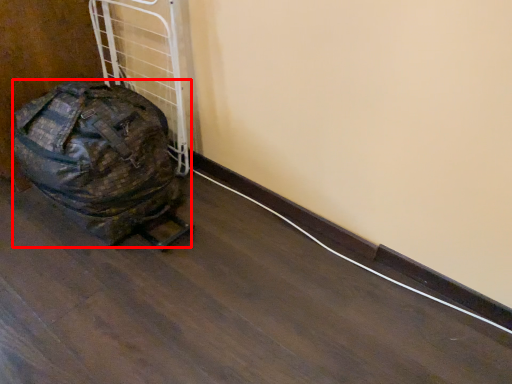
Question: From the image's perspective, where is luggage and bags (annotated by the red box) located relative to wire?

Choices:
 (A) below
 (B) above

Answer: (B)